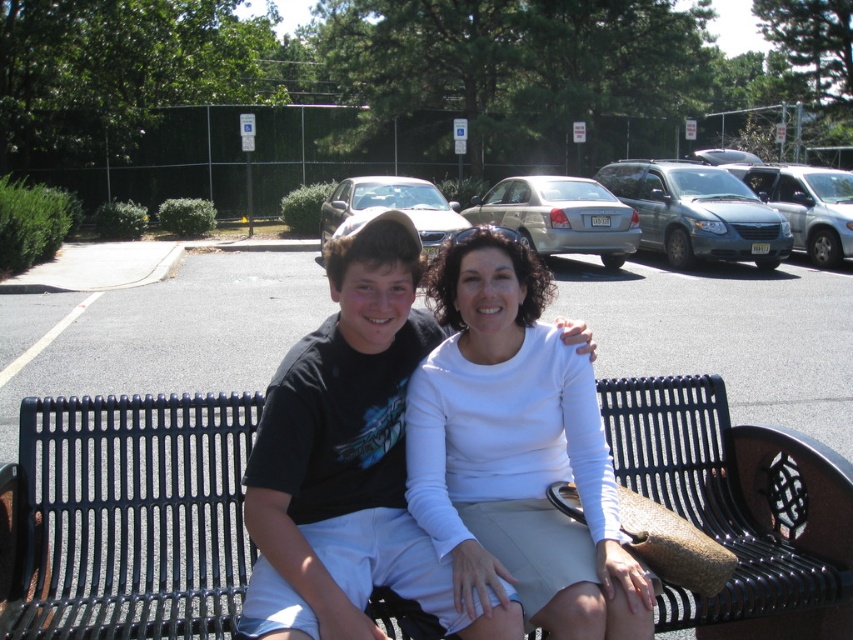
Question: Does black metal bench at center have a larger size compared to white matte shirt at center?

Choices:
 (A) no
 (B) yes

Answer: (B)

Question: Among these points, which one is nearest to the camera?

Choices:
 (A) (611, 621)
 (B) (32, 417)

Answer: (A)

Question: Is black metal bench at center in front of white matte shirt at center?

Choices:
 (A) no
 (B) yes

Answer: (A)

Question: Does black metal bench at center come behind white matte shirt at center?

Choices:
 (A) no
 (B) yes

Answer: (B)